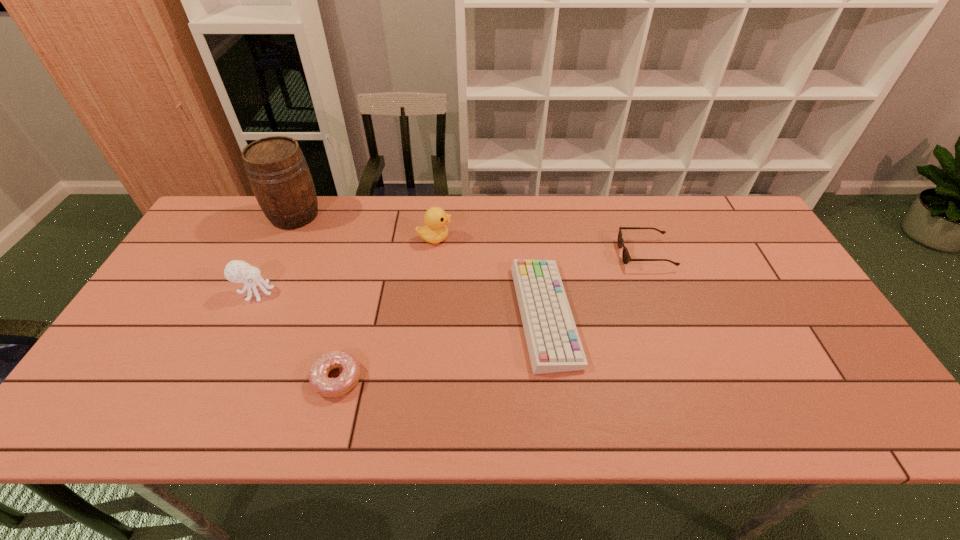
This screenshot has width=960, height=540. What are the coordinates of `empty space between the fifth object from left to right and the cider` in the screenshot? It's located at (420, 265).

Image resolution: width=960 pixels, height=540 pixels. Identify the location of empty space between the fifth object from left to right and the rightmost object. (595, 285).

Where is `free point between the third object from left to right and the octopus`? This screenshot has width=960, height=540. free point between the third object from left to right and the octopus is located at coordinates (297, 335).

This screenshot has width=960, height=540. In order to click on object that stands as the fourth closest to the third object from right to left in this screenshot , I will do `click(318, 376)`.

At what (x,y) coordinates should I click in order to perform the action: click on the second closest object relative to the duck. Please return your answer as a coordinate pair (x, y). Looking at the image, I should click on (277, 171).

Find the location of a particular element. This screenshot has width=960, height=540. free point that satisfies the following two spatial constraints: 1. on the side of the cider near the bung hole; 2. on the left side of the computer keyboard is located at coordinates (248, 315).

Where is `vacant region that satisfies the following two spatial constraints: 1. on the front-facing side of the octopus; 2. on the right side of the third object from left to right`? vacant region that satisfies the following two spatial constraints: 1. on the front-facing side of the octopus; 2. on the right side of the third object from left to right is located at coordinates (214, 379).

Identify the location of vacant space that satisfies the following two spatial constraints: 1. on the front-facing side of the doughnut; 2. on the left side of the octopus. The width and height of the screenshot is (960, 540). (214, 379).

You are a GUI agent. You are given a task and a screenshot of the screen. Output one action in this format:
    pyautogui.click(x=<x>, y=<y>)
    Task: Click on the free space that satisfies the following two spatial constraints: 1. on the side of the computer keyboard near the bung hole; 2. on the left side of the cider
    The image size is (960, 540).
    Given the screenshot: What is the action you would take?
    pyautogui.click(x=248, y=315)

Locate an element on the screen. vacant space that satisfies the following two spatial constraints: 1. on the front-facing side of the octopus; 2. on the back side of the doughnut is located at coordinates (214, 379).